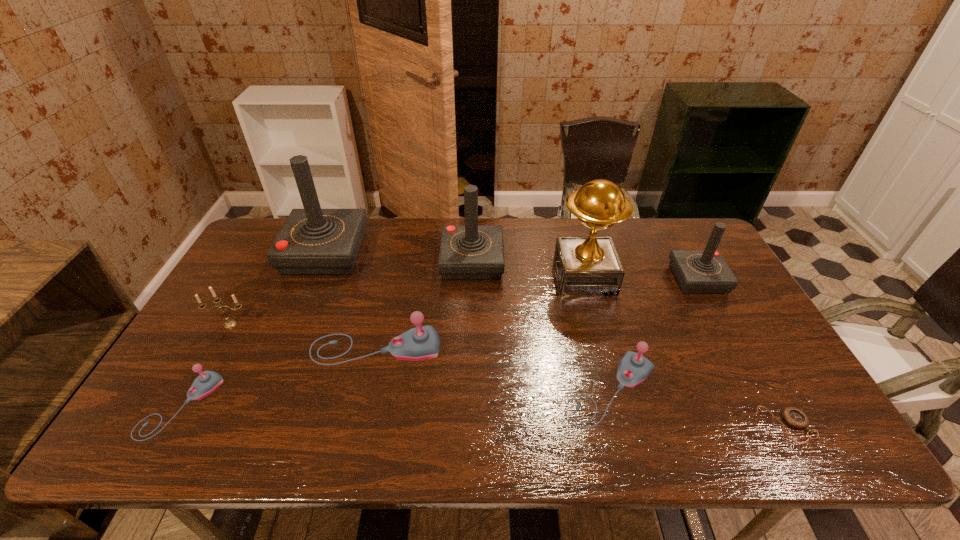
In order to click on free location located on the rectangular base of the second smallest red joystick in this screenshot , I will do `click(470, 348)`.

At what (x,y) coordinates should I click in order to perform the action: click on vacant space located on the rectangular base of the fourth shortest joystick. Please return your answer as a coordinate pair (x, y). This screenshot has height=540, width=960. Looking at the image, I should click on (626, 279).

Locate an element on the screen. The width and height of the screenshot is (960, 540). vacant position located 0.250m on the rectangular base of the fourth shortest joystick is located at coordinates (594, 279).

Identify the location of free location located on the rectangular base of the fourth shortest joystick. The height and width of the screenshot is (540, 960). (556, 279).

Where is `vacant point located 0.350m on the right of the metallic candle`? vacant point located 0.350m on the right of the metallic candle is located at coordinates (374, 325).

This screenshot has width=960, height=540. Identify the location of vacant space located 0.250m on the back of the fourth tallest joystick. (393, 273).

Where is `free space located 0.380m on the back of the second smallest gray joystick`? free space located 0.380m on the back of the second smallest gray joystick is located at coordinates tap(578, 262).

Where is `free point located on the right of the leftmost gray joystick`? This screenshot has height=540, width=960. free point located on the right of the leftmost gray joystick is located at coordinates click(251, 406).

Where is `blank space located on the back of the shortest object`? Image resolution: width=960 pixels, height=540 pixels. blank space located on the back of the shortest object is located at coordinates (734, 333).

Where is `award that is at the far edge`? award that is at the far edge is located at coordinates (589, 265).